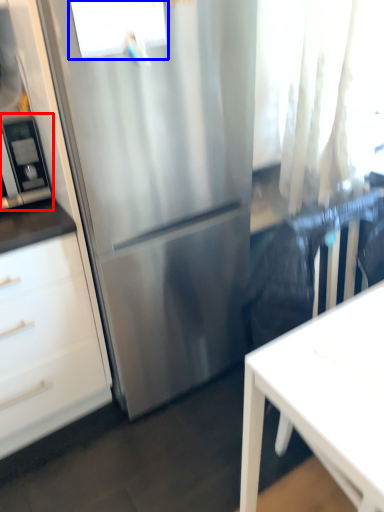
Question: Which of the following is the farthest to the observer, appliance (highlighted by a red box) or window (highlighted by a blue box)?

Choices:
 (A) appliance
 (B) window

Answer: (A)